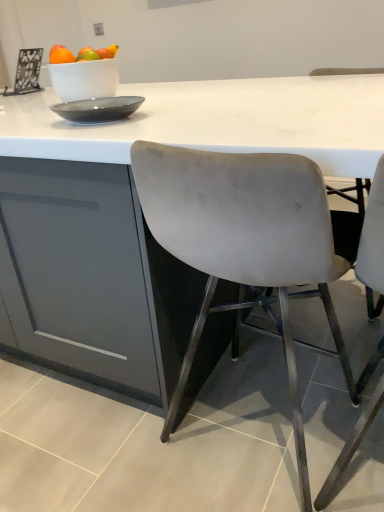
Question: Looking at the image, does matte gray chair at right, positioned as the second chair in left-to-right order, seem bigger or smaller compared to white marble table at center?

Choices:
 (A) big
 (B) small

Answer: (B)

Question: Looking at their shapes, would you say matte gray chair at right, which appears as the first chair when viewed from the right, is wider or thinner than white marble table at center?

Choices:
 (A) thin
 (B) wide

Answer: (A)

Question: Which object is the closest to the satin grey chair at center, placed as the second chair when sorted from right to left?

Choices:
 (A) white marble table at center
 (B) matte gray chair at right, which appears as the first chair when viewed from the right

Answer: (A)

Question: Estimate the real-world distances between objects in this image. Which object is closer to the white marble table at center?

Choices:
 (A) matte gray chair at right, positioned as the second chair in left-to-right order
 (B) satin grey chair at center, which is the 1th chair in left-to-right order

Answer: (B)